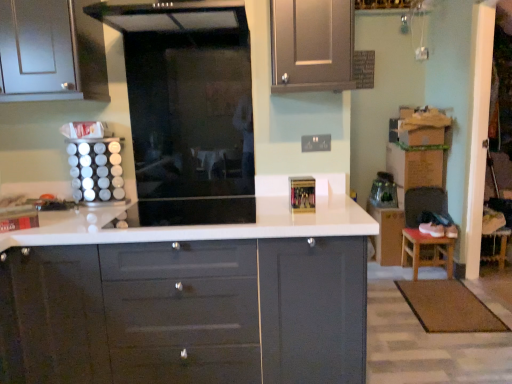
Question: Based on their positions, is transparent glass door at center located to the left or right of white glossy countertop at center?

Choices:
 (A) left
 (B) right

Answer: (A)

Question: Considering the positions of transparent glass door at center and white glossy countertop at center in the image, is transparent glass door at center bigger or smaller than white glossy countertop at center?

Choices:
 (A) small
 (B) big

Answer: (A)

Question: Considering the real-world distances, which object is farthest from the transparent glass door at center?

Choices:
 (A) brown wooden stool at lower right
 (B) white glossy countertop at center
 (C) matte gray cabinet at upper center
 (D) white glossy spice rack at left

Answer: (A)

Question: Estimate the real-world distances between objects in this image. Which object is farther from the transparent glass door at center?

Choices:
 (A) white glossy countertop at center
 (B) brown wooden stool at lower right
 (C) white glossy spice rack at left
 (D) matte gray cabinet at upper center

Answer: (B)